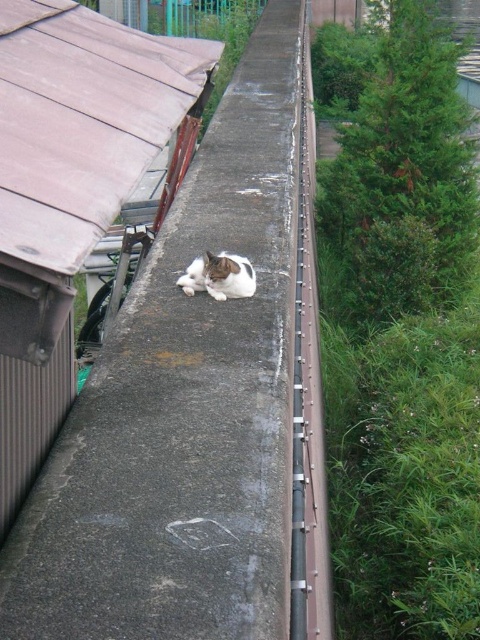
Does gray concrete ledge at center appear on the left side of white-furred cat at center?

No, gray concrete ledge at center is not to the left of white-furred cat at center.

Does gray concrete ledge at center appear under white-furred cat at center?

Actually, gray concrete ledge at center is above white-furred cat at center.

Is point (278, 531) positioned before point (252, 269)?

That is True.

I want to click on gray concrete ledge at center, so click(200, 406).

Can you confirm if gray concrete ledge at center is taller than metallic gray train track at center?

Indeed, gray concrete ledge at center has a greater height compared to metallic gray train track at center.

Between gray concrete ledge at center and metallic gray train track at center, which one appears on the left side from the viewer's perspective?

From the viewer's perspective, gray concrete ledge at center appears more on the left side.

Who is more distant from viewer, (257, 458) or (312, 202)?

Positioned behind is point (312, 202).

At what (x,y) coordinates should I click in order to perform the action: click on gray concrete ledge at center. Please return your answer as a coordinate pair (x, y). This screenshot has height=640, width=480. Looking at the image, I should click on (200, 406).

Is metallic gray train track at center further to the viewer compared to white-furred cat at center?

No, metallic gray train track at center is in front of white-furred cat at center.

Describe the element at coordinates (308, 401) in the screenshot. I see `metallic gray train track at center` at that location.

Describe the element at coordinates (308, 401) in the screenshot. I see `metallic gray train track at center` at that location.

The width and height of the screenshot is (480, 640). Find the location of `metallic gray train track at center`. metallic gray train track at center is located at coordinates (308, 401).